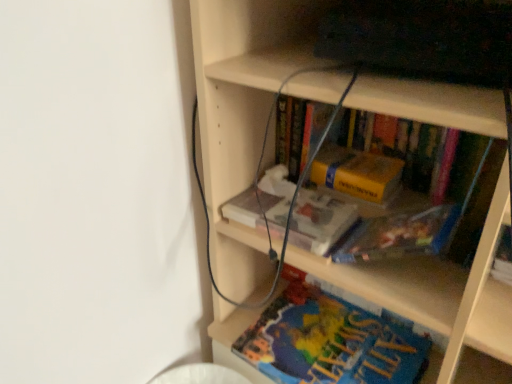
The width and height of the screenshot is (512, 384). What do you see at coordinates (331, 337) in the screenshot? I see `blue matte book at lower center, which is counted as the 1th book, starting from the bottom` at bounding box center [331, 337].

What do you see at coordinates (356, 173) in the screenshot? Image resolution: width=512 pixels, height=384 pixels. I see `yellow matte paperback book at center` at bounding box center [356, 173].

The width and height of the screenshot is (512, 384). I want to click on yellow matte book at center, positioned as the 1th book in top-to-bottom order, so click(x=320, y=221).

Can you confirm if blue matte book at lower center, positioned as the 2th book in top-to-bottom order, is smaller than yellow matte paperback book at center?

Actually, blue matte book at lower center, positioned as the 2th book in top-to-bottom order, might be larger than yellow matte paperback book at center.

Is point (350, 296) closer to camera compared to point (349, 158)?

No, (350, 296) is behind (349, 158).

Considering the relative positions of blue matte book at lower center, which is counted as the 1th book, starting from the bottom, and yellow matte paperback book at center in the image provided, is blue matte book at lower center, which is counted as the 1th book, starting from the bottom, to the right of yellow matte paperback book at center from the viewer's perspective?

No, blue matte book at lower center, which is counted as the 1th book, starting from the bottom, is not to the right of yellow matte paperback book at center.

Does point (250, 347) come in front of point (263, 229)?

That is False.

Is blue matte book at lower center, positioned as the 2th book in top-to-bottom order, further to the viewer compared to yellow matte book at center, positioned as the 1th book in top-to-bottom order?

No, it is not.

Are blue matte book at lower center, positioned as the 2th book in top-to-bottom order, and yellow matte book at center, which is the 2th book from bottom to top, beside each other?

blue matte book at lower center, positioned as the 2th book in top-to-bottom order, and yellow matte book at center, which is the 2th book from bottom to top, are clearly separated.

From a real-world perspective, between blue matte book at lower center, positioned as the 2th book in top-to-bottom order, and yellow matte book at center, which is the 2th book from bottom to top, who is vertically higher?

yellow matte book at center, which is the 2th book from bottom to top, is physically above.

Does point (393, 283) appear closer or farther from the camera than point (354, 154)?

Point (393, 283) is positioned closer to the camera compared to point (354, 154).

Between wooden bookcase at center and yellow matte paperback book at center, which one has less height?

With less height is yellow matte paperback book at center.

Which of these two, wooden bookcase at center or yellow matte paperback book at center, is thinner?

Thinner between the two is yellow matte paperback book at center.

The width and height of the screenshot is (512, 384). I want to click on bookcase lying on the right of yellow matte paperback book at center, so click(x=242, y=115).

Can blue matte book at lower center, positioned as the 2th book in top-to-bottom order, be found inside yellow matte book at center, which is the 2th book from bottom to top?

No, yellow matte book at center, which is the 2th book from bottom to top, does not contain blue matte book at lower center, positioned as the 2th book in top-to-bottom order.

Are yellow matte book at center, which is the 2th book from bottom to top, and blue matte book at lower center, which is counted as the 1th book, starting from the bottom, making contact?

There is a gap between yellow matte book at center, which is the 2th book from bottom to top, and blue matte book at lower center, which is counted as the 1th book, starting from the bottom.

Locate an element on the screen. The width and height of the screenshot is (512, 384). book in front of the yellow matte book at center, which is the 2th book from bottom to top is located at coordinates (331, 337).

Where is `the 2nd book to the left when counting from the yellow matte paperback book at center`? This screenshot has height=384, width=512. the 2nd book to the left when counting from the yellow matte paperback book at center is located at coordinates (320, 221).

Can you confirm if yellow matte paperback book at center is positioned to the left of yellow matte book at center, positioned as the 1th book in top-to-bottom order?

In fact, yellow matte paperback book at center is to the right of yellow matte book at center, positioned as the 1th book in top-to-bottom order.

Is yellow matte paperback book at center bigger than yellow matte book at center, positioned as the 1th book in top-to-bottom order?

No, yellow matte paperback book at center is not bigger than yellow matte book at center, positioned as the 1th book in top-to-bottom order.

What's the angular difference between yellow matte paperback book at center and yellow matte book at center, which is the 2th book from bottom to top,'s facing directions?

The angular difference between yellow matte paperback book at center and yellow matte book at center, which is the 2th book from bottom to top, is 2.07 degrees.

Is there a large distance between blue matte book at lower center, which is counted as the 1th book, starting from the bottom, and wooden bookcase at center?

No, blue matte book at lower center, which is counted as the 1th book, starting from the bottom, is not far from wooden bookcase at center.

Is blue matte book at lower center, which is counted as the 1th book, starting from the bottom, facing towards wooden bookcase at center?

Yes.

What's the angular difference between blue matte book at lower center, positioned as the 2th book in top-to-bottom order, and wooden bookcase at center's facing directions?

The angle between the facing direction of blue matte book at lower center, positioned as the 2th book in top-to-bottom order, and the facing direction of wooden bookcase at center is 1.63 degrees.

From the picture: From the image's perspective, is blue matte book at lower center, which is counted as the 1th book, starting from the bottom, located above wooden bookcase at center?

No, from the image's perspective, blue matte book at lower center, which is counted as the 1th book, starting from the bottom, is not above wooden bookcase at center.

Between yellow matte book at center, positioned as the 1th book in top-to-bottom order, and yellow matte paperback book at center, which one has larger width?

Wider between the two is yellow matte book at center, positioned as the 1th book in top-to-bottom order.

Is yellow matte book at center, which is the 2th book from bottom to top, taller or shorter than yellow matte paperback book at center?

Considering their sizes, yellow matte book at center, which is the 2th book from bottom to top, has less height than yellow matte paperback book at center.

Are yellow matte book at center, positioned as the 1th book in top-to-bottom order, and yellow matte paperback book at center making contact?

No, yellow matte book at center, positioned as the 1th book in top-to-bottom order, is not in contact with yellow matte paperback book at center.

Based on the photo, how different are the orientations of yellow matte book at center, positioned as the 1th book in top-to-bottom order, and yellow matte paperback book at center in degrees?

There is a 2.07-degree angle between the facing directions of yellow matte book at center, positioned as the 1th book in top-to-bottom order, and yellow matte paperback book at center.

At what (x,y) coordinates should I click in order to perform the action: click on book that is the 2nd one when counting forward from the yellow matte paperback book at center. Please return your answer as a coordinate pair (x, y). Looking at the image, I should click on (331, 337).

Identify the location of book located below the yellow matte book at center, which is the 2th book from bottom to top (from the image's perspective). (331, 337).

Which object lies further to the anchor point yellow matte book at center, which is the 2th book from bottom to top, wooden bookcase at center or blue matte book at lower center, which is counted as the 1th book, starting from the bottom?

blue matte book at lower center, which is counted as the 1th book, starting from the bottom, lies further to yellow matte book at center, which is the 2th book from bottom to top, than the other object.

Which object lies nearer to the anchor point wooden bookcase at center, blue matte book at lower center, positioned as the 2th book in top-to-bottom order, or yellow matte book at center, positioned as the 1th book in top-to-bottom order?

yellow matte book at center, positioned as the 1th book in top-to-bottom order, is positioned closer to the anchor wooden bookcase at center.

Looking at the image, which one is located further to yellow matte paperback book at center, wooden bookcase at center or blue matte book at lower center, positioned as the 2th book in top-to-bottom order?

blue matte book at lower center, positioned as the 2th book in top-to-bottom order.

Looking at the image, which one is located closer to wooden bookcase at center, yellow matte paperback book at center or blue matte book at lower center, positioned as the 2th book in top-to-bottom order?

The object closer to wooden bookcase at center is yellow matte paperback book at center.

Estimate the real-world distances between objects in this image. Which object is closer to yellow matte paperback book at center, blue matte book at lower center, which is counted as the 1th book, starting from the bottom, or yellow matte book at center, positioned as the 1th book in top-to-bottom order?

yellow matte book at center, positioned as the 1th book in top-to-bottom order, is positioned closer to the anchor yellow matte paperback book at center.

Based on the photo, considering their positions, is yellow matte paperback book at center positioned further to wooden bookcase at center than yellow matte book at center, positioned as the 1th book in top-to-bottom order?

yellow matte paperback book at center lies further to wooden bookcase at center than the other object.

From the image, which object appears to be nearer to yellow matte book at center, which is the 2th book from bottom to top, blue matte book at lower center, positioned as the 2th book in top-to-bottom order, or yellow matte paperback book at center?

Based on the image, yellow matte paperback book at center appears to be nearer to yellow matte book at center, which is the 2th book from bottom to top.

Which object lies nearer to the anchor point yellow matte paperback book at center, yellow matte book at center, which is the 2th book from bottom to top, or blue matte book at lower center, positioned as the 2th book in top-to-bottom order?

yellow matte book at center, which is the 2th book from bottom to top, is positioned closer to the anchor yellow matte paperback book at center.

Image resolution: width=512 pixels, height=384 pixels. I want to click on book positioned between wooden bookcase at center and yellow matte book at center, positioned as the 1th book in top-to-bottom order, from near to far, so click(331, 337).

Locate an element on the screen. book between yellow matte paperback book at center and blue matte book at lower center, which is counted as the 1th book, starting from the bottom, from top to bottom is located at coordinates (320, 221).